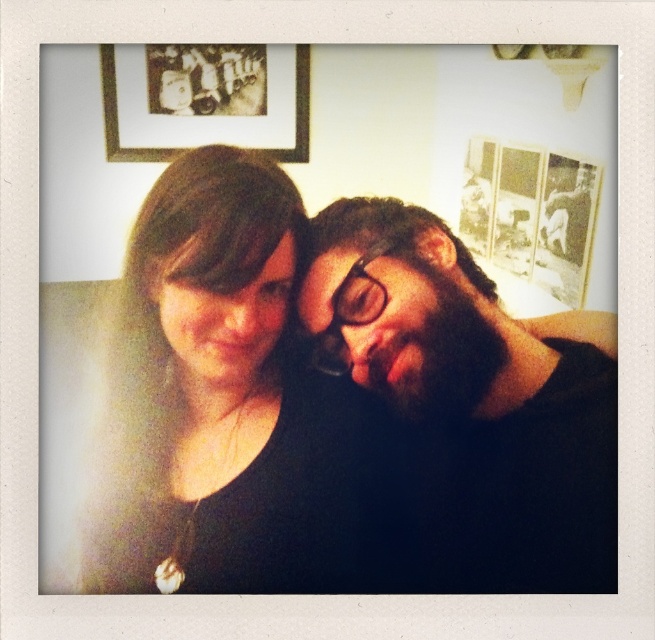
Is dark brown hair at center wider than matte black frame at upper left?

Yes.

Is the position of dark brown hair at center less distant than that of matte black frame at upper left?

No, it is behind matte black frame at upper left.

The height and width of the screenshot is (640, 655). What do you see at coordinates (472, 400) in the screenshot?
I see `dark brown hair at center` at bounding box center [472, 400].

The width and height of the screenshot is (655, 640). What are the coordinates of `dark brown hair at center` in the screenshot? It's located at (472, 400).

How much distance is there between black matte hair at center and matte black frame at upper left?

21.97 centimeters

Identify the location of black matte hair at center. (227, 401).

Who is shorter, black matte hair at center or dark brown hair at center?

With less height is dark brown hair at center.

Is black matte hair at center taller than dark brown hair at center?

Indeed, black matte hair at center has a greater height compared to dark brown hair at center.

Which is in front, point (231, 458) or point (487, 285)?

Positioned in front is point (231, 458).

This screenshot has height=640, width=655. Identify the location of black matte hair at center. (227, 401).